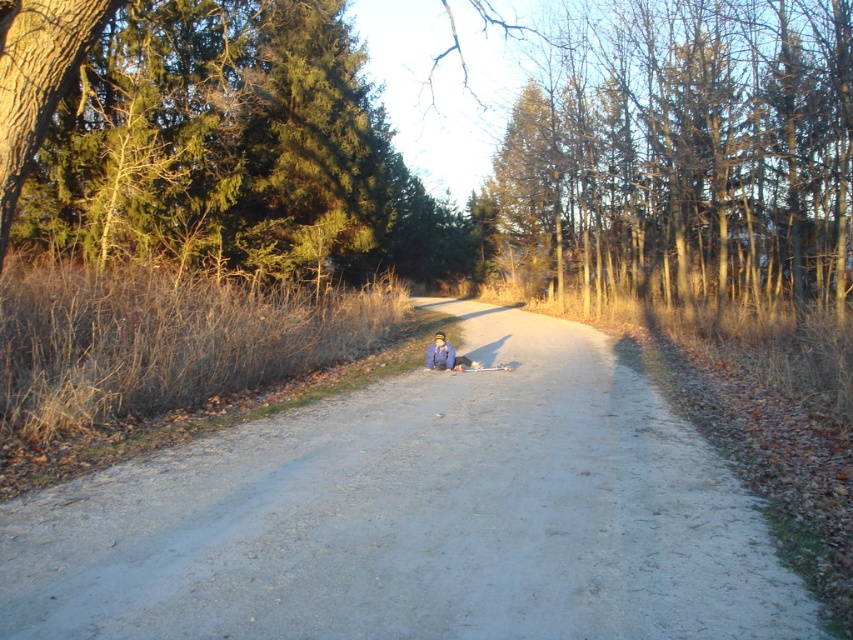
You are standing on the dirt road in the rural scene. There are two points marked on the ground. One is at coordinates point [164,502] and the other is at point [433,353]. Which point is closer to you?

Point [164,502] is closer to the viewer than point [433,353].